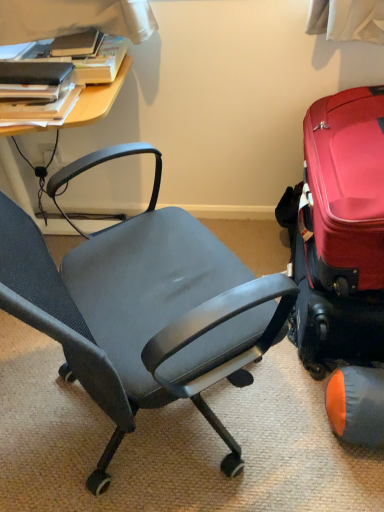
Question: Do you think orange fabric bean bag chair at lower right is within hardcover book at upper left, which is counted as the 1th book, starting from the top, or outside of it?

Choices:
 (A) inside
 (B) outside

Answer: (B)

Question: In the image, is orange fabric bean bag chair at lower right positioned in front of or behind hardcover book at upper left, which appears as the second book when ordered from the bottom?

Choices:
 (A) front
 (B) behind

Answer: (A)

Question: Which of these objects is positioned closest to the hardcover book at upper left, which is counted as the 1th book, starting from the top?

Choices:
 (A) matte black book at upper left, arranged as the 1th book when ordered from the bottom
 (B) orange fabric bean bag chair at lower right
 (C) shiny red suitcase at right

Answer: (A)

Question: Which of these objects is positioned farthest from the matte black book at upper left, which is the second book in top-to-bottom order?

Choices:
 (A) shiny red suitcase at right
 (B) hardcover book at upper left, which is counted as the 1th book, starting from the top
 (C) orange fabric bean bag chair at lower right

Answer: (C)